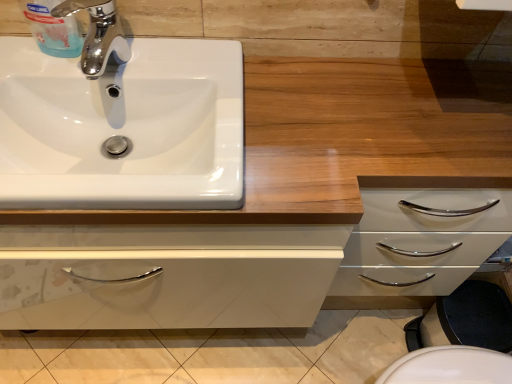
Locate an element on the screen. Image resolution: width=512 pixels, height=384 pixels. free spot above wooden counter at upper center (from a real-world perspective) is located at coordinates (316, 130).